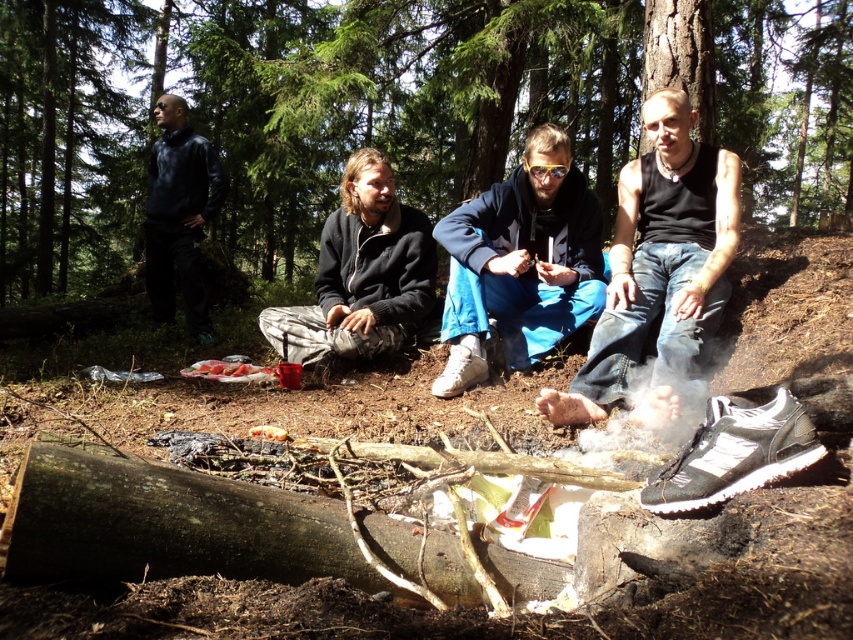
Question: Which object is closer to the camera taking this photo?

Choices:
 (A) dark blue fleece at upper left
 (B) black denim jeans at center

Answer: (B)

Question: Can you confirm if blue fleece jacket at center is positioned to the left of dark blue fleece at upper left?

Choices:
 (A) no
 (B) yes

Answer: (A)

Question: Which object is positioned closest to the black denim jeans at center?

Choices:
 (A) dark gray fleece jacket at center
 (B) dark blue fleece at upper left
 (C) brown wood tree at center

Answer: (A)

Question: Can you confirm if brown wood tree at center is positioned above dark blue fleece at upper left?

Choices:
 (A) no
 (B) yes

Answer: (B)

Question: Is brown wood tree at center thinner than blue fleece jacket at center?

Choices:
 (A) yes
 (B) no

Answer: (B)

Question: Estimate the real-world distances between objects in this image. Which object is farther from the black denim jeans at center?

Choices:
 (A) brown wood tree at center
 (B) blue fleece jacket at center
 (C) dark blue fleece at upper left

Answer: (A)